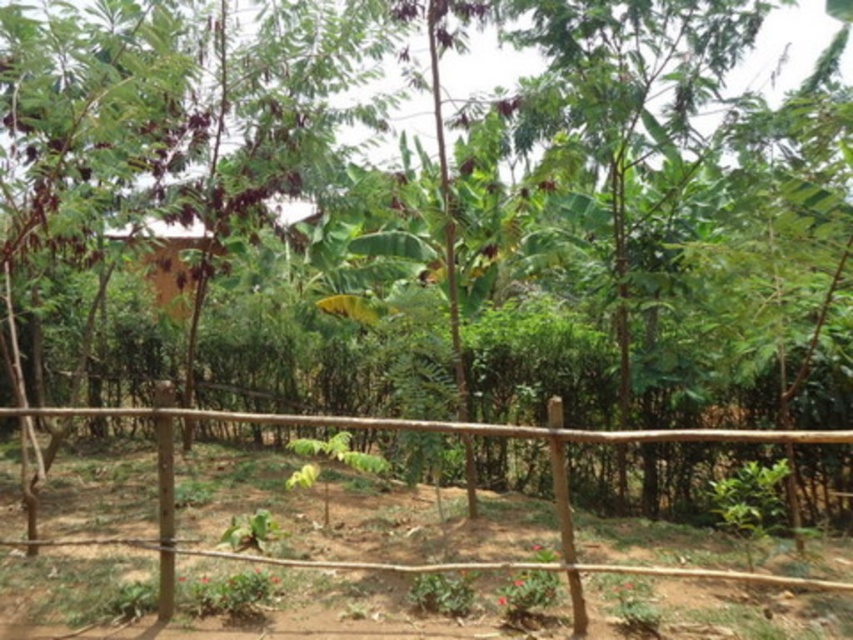
You are planning to place a new garden bench that is 1.2 meters wide between the brown wooden fence at center and the wooden hut at center. Given their sizes, will there be enough space for the bench between them?

The brown wooden fence at center has a smaller size compared to wooden hut at center. Since the bench is 1.2 meters wide, it depends on the distance between them. However, the description only mentions their relative sizes, not the distance. Without knowing the exact distance between the two objects, we cannot determine if there is enough space for the bench.

You are planning to install a solar panel on the tallest structure in the scene. Which object should you choose between the brown wooden fence at center and the wooden hut at center?

The wooden hut at center is taller than the brown wooden fence at center, so you should install the solar panel on the wooden hut at center.

You are standing at the origin point of the image. Which direction should you move to reach the brown wooden fence at center?

The brown wooden fence at center is located at point 0.684 on the x axis and 0.545 on the y axis. Since you are at the origin, you should move towards the right and slightly upwards to reach it.